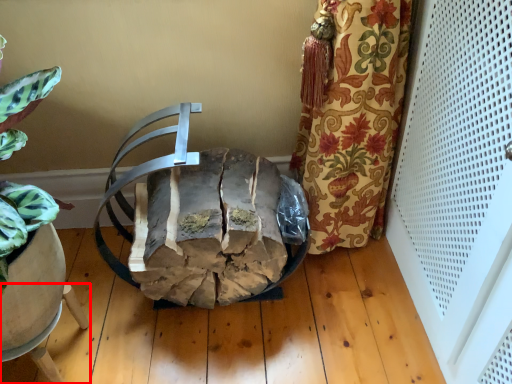
Question: Observing the image, what is the correct spatial positioning of furniture (annotated by the red box) in reference to chair?

Choices:
 (A) left
 (B) right

Answer: (A)